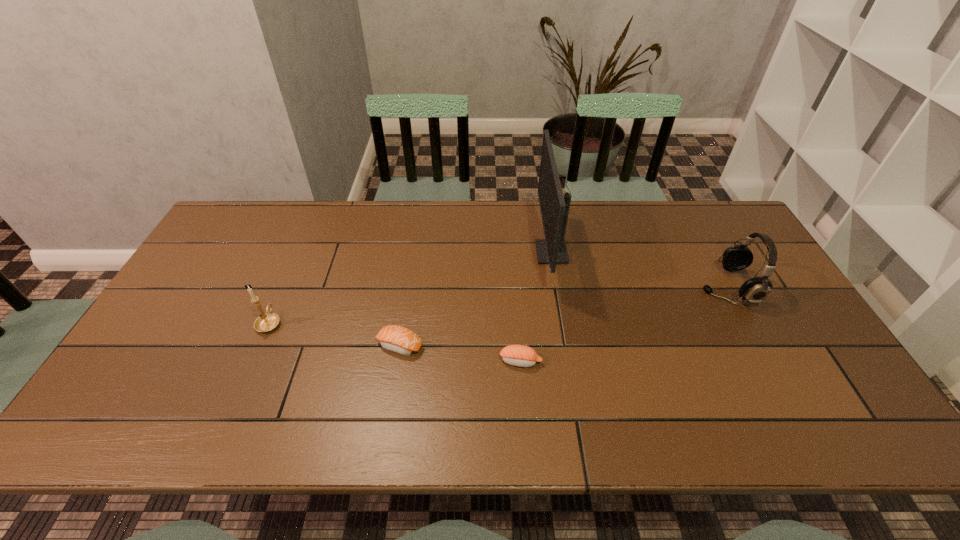
I want to click on vacant area that lies between the right sushi and the second object from left to right, so click(x=461, y=353).

I want to click on free spot between the fourth object from right to left and the fourth shortest object, so click(x=564, y=316).

Find the location of a particular element. free space between the fourth object from right to left and the rightmost object is located at coordinates (564, 316).

The image size is (960, 540). I want to click on vacant area that lies between the rightmost object and the left sushi, so click(x=564, y=316).

Find the location of a particular element. free space between the second object from right to left and the right sushi is located at coordinates 536,307.

Locate an element on the screen. vacant space that is in between the leftmost object and the headset is located at coordinates (498, 305).

Where is `object identified as the fourth closest to the second object from left to right`? The height and width of the screenshot is (540, 960). object identified as the fourth closest to the second object from left to right is located at coordinates (755, 290).

Locate an element on the screen. The height and width of the screenshot is (540, 960). object that is the closest one to the left sushi is located at coordinates (518, 355).

At what (x,y) coordinates should I click in order to perform the action: click on vacant region that satisfies the following two spatial constraints: 1. with the microphone on the side of the headset; 2. on the front side of the right sushi. Please return your answer as a coordinate pair (x, y). The image size is (960, 540). Looking at the image, I should click on (767, 361).

I want to click on vacant space that satisfies the following two spatial constraints: 1. on the front-facing side of the second object from right to left; 2. on the front side of the right sushi, so click(x=569, y=361).